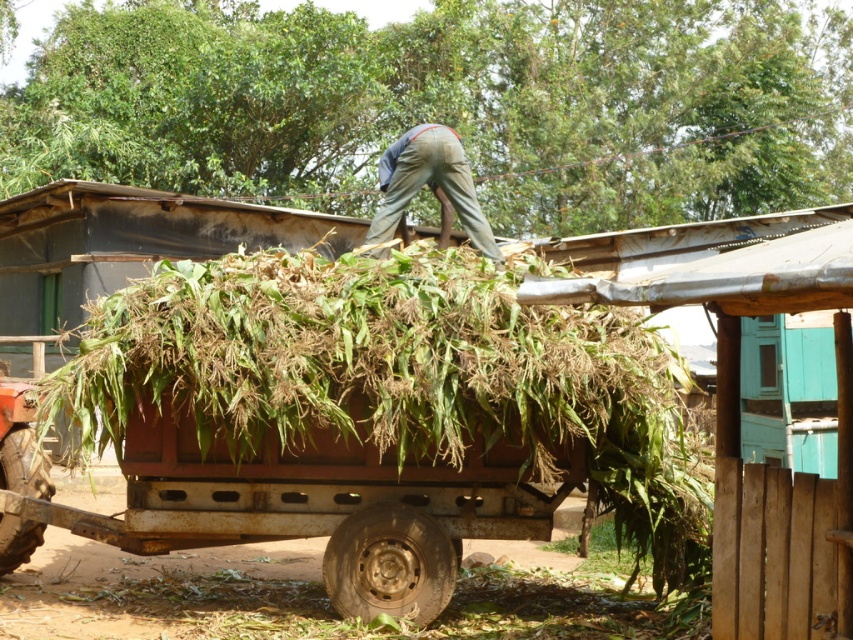
Is green leafy hay at center shorter than khaki pants at center?

Incorrect, green leafy hay at center's height does not fall short of khaki pants at center's.

Measure the distance between green leafy hay at center and khaki pants at center.

green leafy hay at center is 5.96 feet from khaki pants at center.

You are a GUI agent. You are given a task and a screenshot of the screen. Output one action in this format:
    pyautogui.click(x=<x>, y=<y>)
    Task: Click on the green leafy hay at center
    The width and height of the screenshot is (853, 640).
    Given the screenshot: What is the action you would take?
    pyautogui.click(x=378, y=365)

Is green leafy hay at center below rusty metal wagon at center?

No.

Is green leafy hay at center to the left of rusty metal wagon at center from the viewer's perspective?

Incorrect, green leafy hay at center is not on the left side of rusty metal wagon at center.

Is point (196, 268) behind point (335, 472)?

No, (196, 268) is closer to viewer.

Identify the location of green leafy hay at center. (378, 365).

Does rusty metal wagon at center lie behind khaki pants at center?

No, it is in front of khaki pants at center.

Between point (570, 477) and point (451, 173), which one is positioned in front?

Point (570, 477) is in front.

You are a GUI agent. You are given a task and a screenshot of the screen. Output one action in this format:
    pyautogui.click(x=<x>, y=<y>)
    Task: Click on the rusty metal wagon at center
    This screenshot has width=853, height=640.
    Given the screenshot: What is the action you would take?
    pyautogui.click(x=315, y=509)